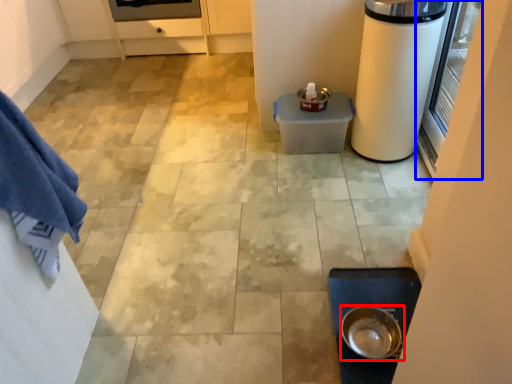
Question: Which object is closer to the camera taking this photo, kitchen appliance (highlighted by a red box) or screen door (highlighted by a blue box)?

Choices:
 (A) kitchen appliance
 (B) screen door

Answer: (B)